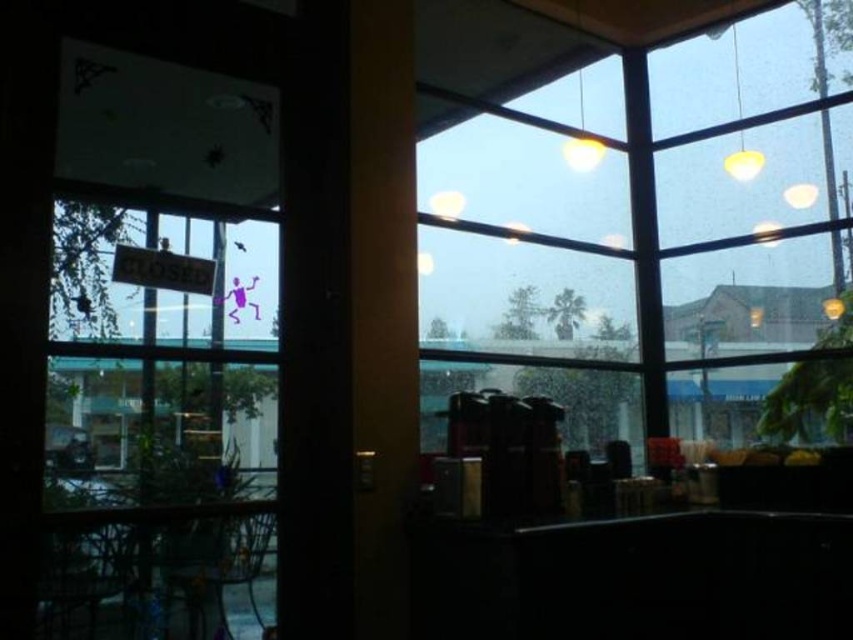
Measure the distance from transparent glass door at left to yellow matte lamp at upper right.

A distance of 9.06 feet exists between transparent glass door at left and yellow matte lamp at upper right.

Does point (193, 458) lie behind point (737, 163)?

No, it is not.

Identify the location of transparent glass door at left. This screenshot has height=640, width=853. click(158, 420).

Locate an element on the screen. transparent glass door at left is located at coordinates (158, 420).

Which is more to the left, transparent glass window at upper right or yellow matte lamp at upper right?

transparent glass window at upper right

Is transparent glass window at upper right further to the viewer compared to yellow matte lamp at upper right?

No, it is not.

Who is more distant from viewer, (418, 150) or (746, 170)?

Positioned behind is point (746, 170).

Identify the location of transparent glass window at upper right. This screenshot has width=853, height=640. (650, 220).

Can you confirm if transparent glass window at upper right is shorter than transparent glass door at left?

No, transparent glass window at upper right is not shorter than transparent glass door at left.

Is transparent glass window at upper right taller than transparent glass door at left?

Correct, transparent glass window at upper right is much taller as transparent glass door at left.

Is point (814, 243) in front of point (138, 476)?

No.

Locate an element on the screen. This screenshot has height=640, width=853. transparent glass window at upper right is located at coordinates (650, 220).